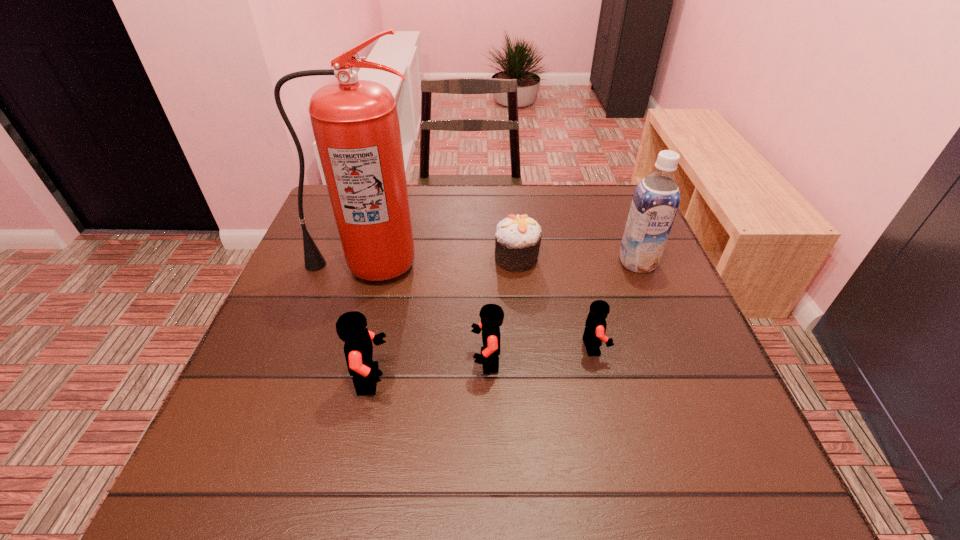
The height and width of the screenshot is (540, 960). Identify the location of vacant point located between the cupcake and the leftmost Lego. (444, 319).

This screenshot has height=540, width=960. What are the coordinates of `vacant area that lies between the rightmost Lego and the cupcake` in the screenshot? It's located at (555, 302).

Locate an element on the screen. unoccupied area between the fire extinguisher and the cupcake is located at coordinates (441, 261).

Find the location of a particular element. vacant space that is in between the cupcake and the fire extinguisher is located at coordinates (441, 261).

What are the coordinates of `vacant space in between the cupcake and the fifth shortest object` in the screenshot? It's located at (577, 260).

Where is `object that is the second closest to the second shortest Lego`? The height and width of the screenshot is (540, 960). object that is the second closest to the second shortest Lego is located at coordinates (595, 326).

Where is `the fifth closest object to the fourth tallest object`? The height and width of the screenshot is (540, 960). the fifth closest object to the fourth tallest object is located at coordinates (656, 199).

Select which Lego appears as the second closest to the rightmost object. Please provide its 2D coordinates. Your answer should be formatted as a tuple, i.e. [(x, y)], where the tuple contains the x and y coordinates of a point satisfying the conditions above.

[(492, 315)]

Choose which Lego is the nearest neighbor to the shortest Lego. Please provide its 2D coordinates. Your answer should be formatted as a tuple, i.e. [(x, y)], where the tuple contains the x and y coordinates of a point satisfying the conditions above.

[(492, 315)]

This screenshot has width=960, height=540. I want to click on free location that satisfies the following two spatial constraints: 1. on the label of the soya milk; 2. on the front-facing side of the fourth tallest object, so click(678, 362).